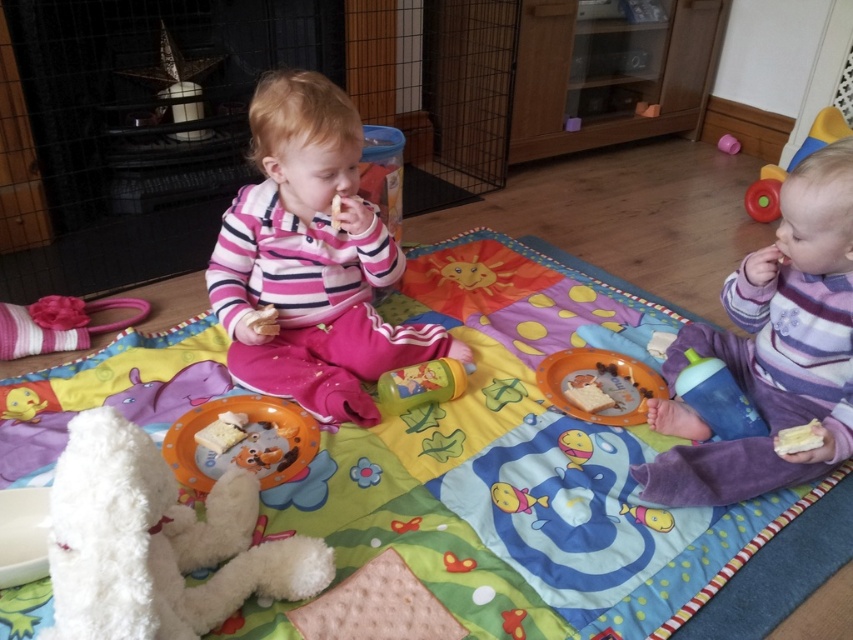
Consider the image. You are a parent looking for a cup for your child. You see the pink fleece sweater at center and the matte pink cup at upper right. Which item is larger?

The pink fleece sweater at center is bigger than the matte pink cup at upper right, so the sweater is the larger item.

You are a parent looking for your child. You see the multicolored fabric play mat at center and the purple fleece toddler at lower right. Which object is closer to the floor?

The multicolored fabric play mat at center is located below the purple fleece toddler at lower right, so it is closer to the floor.